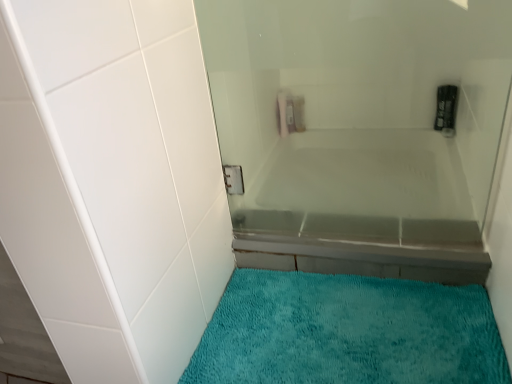
The height and width of the screenshot is (384, 512). Identify the location of vacant space in white glossy bathtub at center (from a real-world perspective). (353, 236).